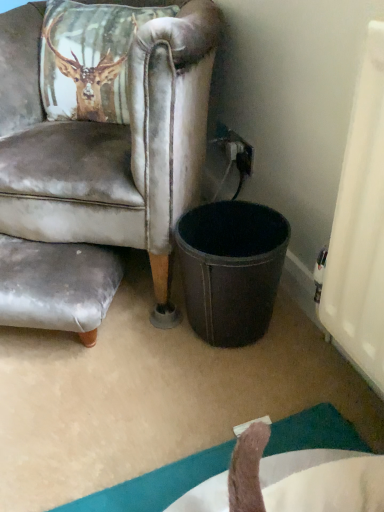
Question: From the image's perspective, is black leather trash bin/can at lower center above or below black plastic power outlet at upper right?

Choices:
 (A) below
 (B) above

Answer: (A)

Question: From a real-world perspective, is black leather trash bin/can at lower center physically located above or below black plastic power outlet at upper right?

Choices:
 (A) above
 (B) below

Answer: (B)

Question: Estimate the real-world distances between objects in this image. Which object is closer to the black leather trash bin/can at lower center?

Choices:
 (A) leather at right
 (B) gray fabric swivel chair at lower left
 (C) black plastic power outlet at upper right

Answer: (A)

Question: Which object is the farthest from the black leather trash bin/can at lower center?

Choices:
 (A) leather at right
 (B) black plastic power outlet at upper right
 (C) gray fabric swivel chair at lower left

Answer: (B)